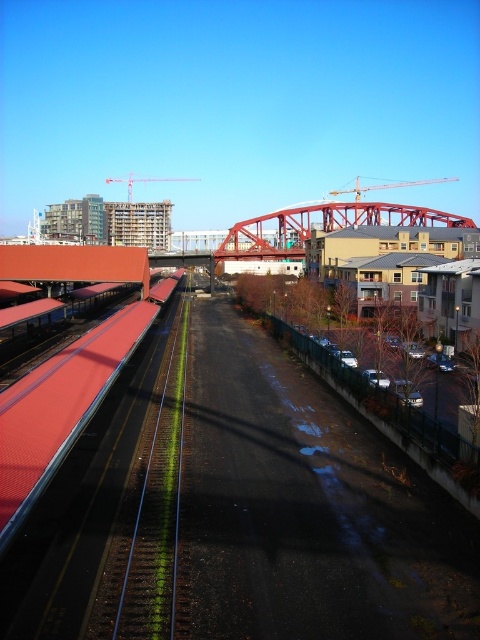
Is metallic red bridge at center wider than metallic construction crane at upper center?

Yes, metallic red bridge at center is wider than metallic construction crane at upper center.

The width and height of the screenshot is (480, 640). Describe the element at coordinates (323, 227) in the screenshot. I see `metallic red bridge at center` at that location.

This screenshot has height=640, width=480. I want to click on metallic red bridge at center, so click(x=323, y=227).

Which of these two, metallic red crane at upper center or metallic construction crane at upper center, stands taller?

With more height is metallic red crane at upper center.

Is point (357, 184) farther from camera compared to point (120, 180)?

Yes, point (357, 184) is farther from viewer.

Find the location of a particular element. This screenshot has height=640, width=480. metallic red crane at upper center is located at coordinates (388, 186).

Who is more forward, (10, 458) or (274, 225)?

Point (10, 458) is in front.

Which is behind, point (123, 356) or point (300, 237)?

Positioned behind is point (300, 237).

Identify the location of smooth red platform at left. (62, 403).